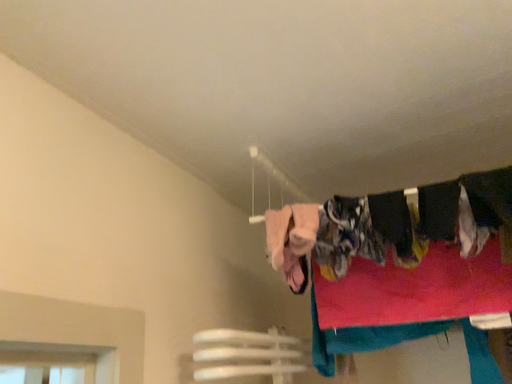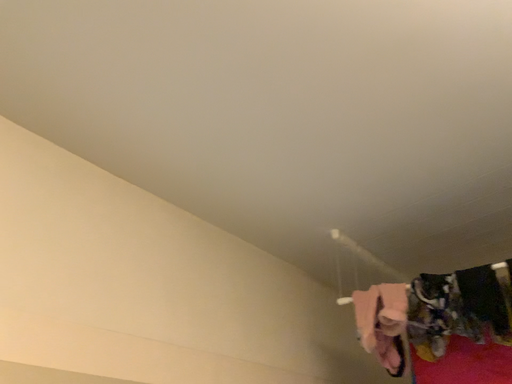
Question: How did the camera likely rotate when shooting the video?

Choices:
 (A) rotated downward
 (B) rotated upward

Answer: (B)